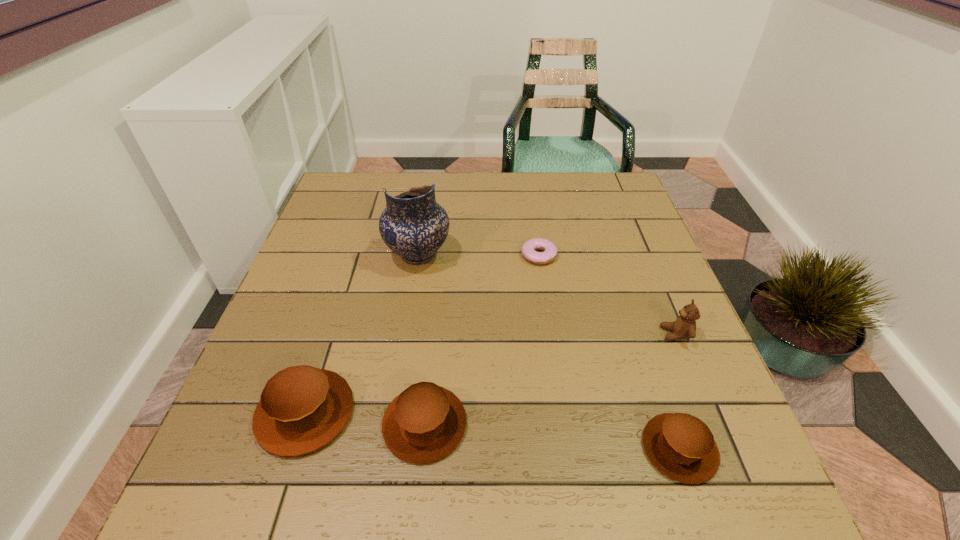
The height and width of the screenshot is (540, 960). I want to click on vacant space that satisfies the following two spatial constraints: 1. on the front side of the second muffin from right to left; 2. on the left side of the leftmost muffin, so click(301, 424).